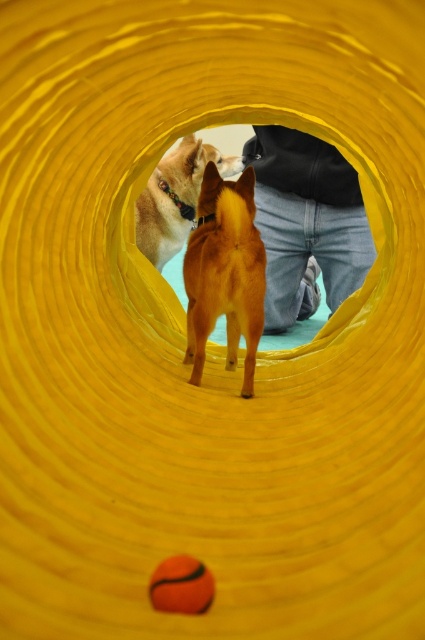
Question: In this image, where is shiny golden fur at center located relative to shiny brown fur at center?

Choices:
 (A) above
 (B) below

Answer: (B)

Question: Can you confirm if shiny golden fur at center is wider than shiny brown fur at center?

Choices:
 (A) yes
 (B) no

Answer: (B)

Question: Which of the following is the farthest from the observer?

Choices:
 (A) shiny brown fur at center
 (B) shiny golden fur at center

Answer: (A)

Question: Does shiny golden fur at center have a lesser width compared to shiny brown fur at center?

Choices:
 (A) yes
 (B) no

Answer: (A)